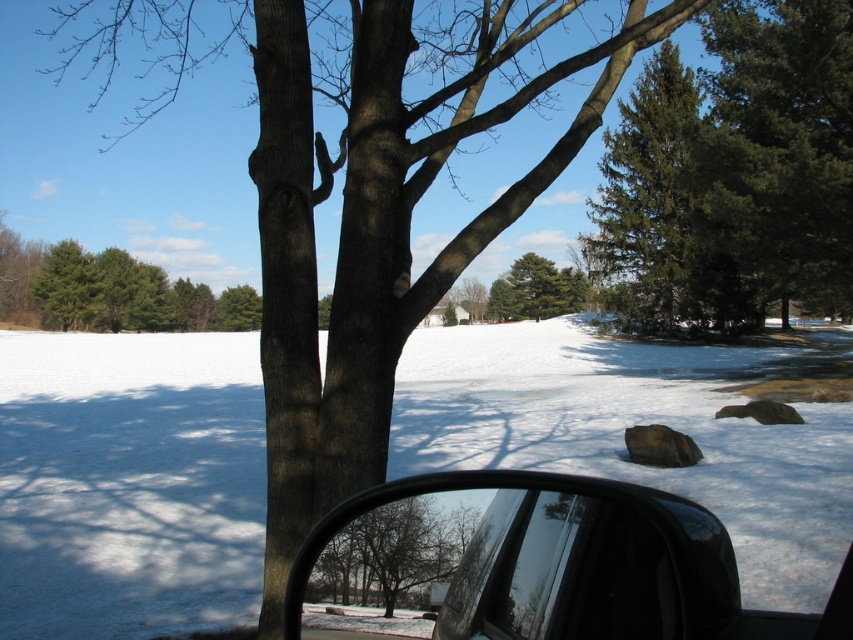
Question: Which of these objects is positioned closest to the green textured pine tree at upper right?

Choices:
 (A) white powdery snow at center
 (B) green matte tree at center
 (C) black glossy side mirror at lower right

Answer: (A)

Question: Is green textured pine tree at upper right smaller than green matte tree at center?

Choices:
 (A) no
 (B) yes

Answer: (A)

Question: Is white powdery snow at center positioned behind green textured pine tree at upper right?

Choices:
 (A) yes
 (B) no

Answer: (B)

Question: Which object is the closest to the green matte tree at center?

Choices:
 (A) white powdery snow at center
 (B) green matte tree at upper left
 (C) black glossy side mirror at lower right

Answer: (A)

Question: Observing the image, what is the correct spatial positioning of black glossy side mirror at lower right in reference to green textured pine tree at upper right?

Choices:
 (A) left
 (B) right

Answer: (A)

Question: Which point is farther to the camera?

Choices:
 (A) green matte tree at upper left
 (B) green textured pine tree at upper right
 (C) black glossy side mirror at lower right

Answer: (A)